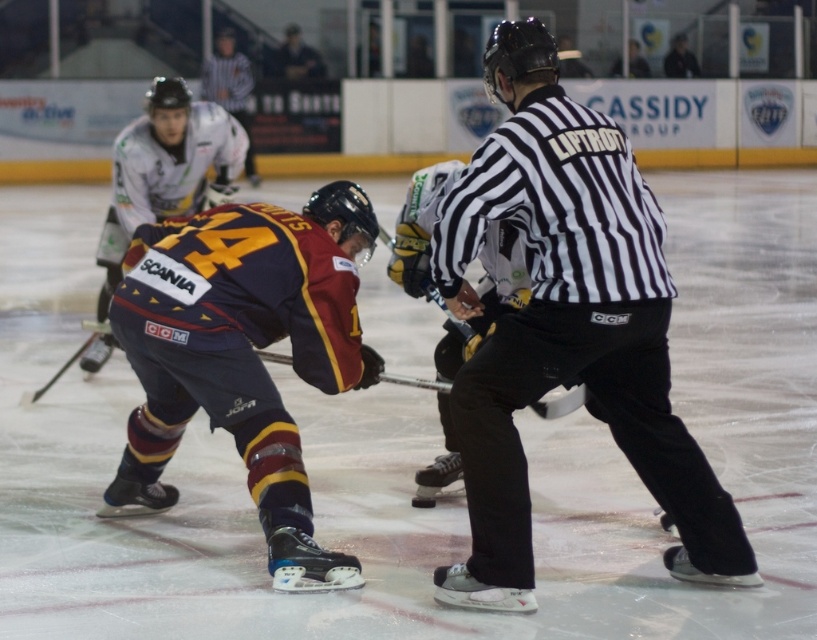
You are a player in an ice hockey game and you want to pass the puck to your teammate located at point (x=569, y=400). You are currently at point (x=538, y=189). Considering the referee is between you and your teammate, can you still make the pass without the referee interfering?

Point (x=538, y=189) is in front of point (x=569, y=400), so the referee is not between you and your teammate. You can make the pass without interference.

You are a photographer positioned at the center of the ice rink during an ice hockey game. You want to take a photo of the point at coordinates point (208, 148). The camera has a focal length of 50mm and a sensor size of 24mm x 36mm. Calculate the minimum distance in feet you need to be from the point to ensure the entire point fits within the camera sensor. Assume the point is a small object with negligible size.

The distance of point (208, 148) from camera is 32.98 feet, so you need to be at least 32.98 feet away to ensure the point fits within the camera sensor.

You are an ice hockey player who needs to retrieve your black rubber hockey stick at center. You are currently standing 1 meter away from the black striped shirt at center. Can you reach your stick without moving closer?

The distance between the black striped shirt at center and the black rubber hockey stick at center is 95.76 centimeters. Since you are 1 meter away from the shirt, your total distance to the stick is approximately 1 meter plus 95.76 centimeters, which is more than 1 meter. Therefore, you cannot reach the stick without moving closer.